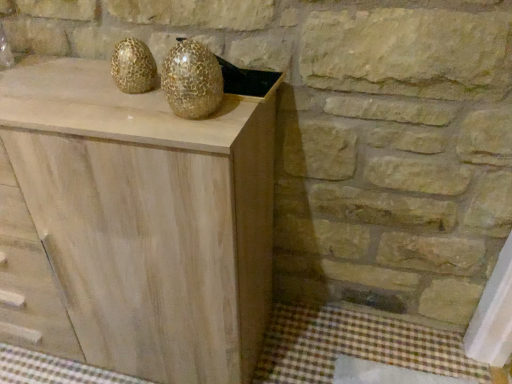
Question: Does gold textured vase at center appear on the right side of natural wood cabinet at center?

Choices:
 (A) no
 (B) yes

Answer: (B)

Question: Is gold textured vase at center oriented towards natural wood cabinet at center?

Choices:
 (A) no
 (B) yes

Answer: (A)

Question: Is gold textured vase at center completely or partially outside of natural wood cabinet at center?

Choices:
 (A) yes
 (B) no

Answer: (A)

Question: Can natural wood cabinet at center be found inside gold textured vase at center?

Choices:
 (A) yes
 (B) no

Answer: (B)

Question: Does gold textured vase at center have a lesser width compared to natural wood cabinet at center?

Choices:
 (A) no
 (B) yes

Answer: (B)

Question: Is gold textured vase at center further to the viewer compared to natural wood cabinet at center?

Choices:
 (A) no
 (B) yes

Answer: (B)

Question: Does natural wood cabinet at center appear on the right side of gold textured vase at center?

Choices:
 (A) yes
 (B) no

Answer: (B)

Question: Are natural wood cabinet at center and gold textured vase at center making contact?

Choices:
 (A) no
 (B) yes

Answer: (A)

Question: Is natural wood cabinet at center facing towards gold textured vase at center?

Choices:
 (A) no
 (B) yes

Answer: (A)

Question: From the image's perspective, is natural wood cabinet at center under gold textured vase at center?

Choices:
 (A) no
 (B) yes

Answer: (B)

Question: Would you say natural wood cabinet at center is a long distance from gold textured vase at center?

Choices:
 (A) yes
 (B) no

Answer: (B)

Question: Considering the relative sizes of natural wood cabinet at center and gold textured vase at center in the image provided, is natural wood cabinet at center shorter than gold textured vase at center?

Choices:
 (A) no
 (B) yes

Answer: (A)

Question: Does point (267, 235) appear closer or farther from the camera than point (179, 91)?

Choices:
 (A) farther
 (B) closer

Answer: (A)